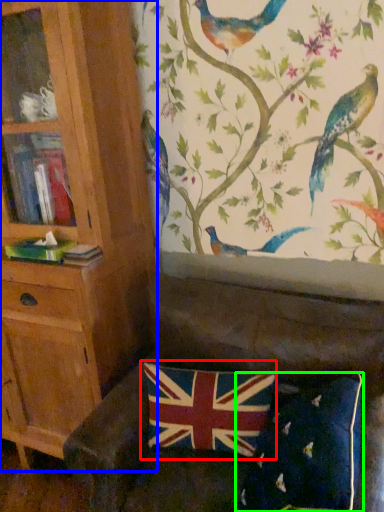
Question: Which object is the farthest from flag (highlighted by a red box)? Choose among these: bookcase (highlighted by a blue box) or pillow (highlighted by a green box).

Choices:
 (A) bookcase
 (B) pillow

Answer: (A)